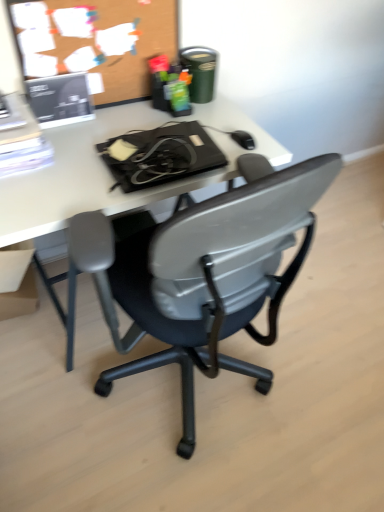
Question: From the image's perspective, is matte cardboard box at lower left on top of white plastic desk at center?

Choices:
 (A) yes
 (B) no

Answer: (B)

Question: Is matte cardboard box at lower left shorter than white plastic desk at center?

Choices:
 (A) no
 (B) yes

Answer: (B)

Question: Is matte cardboard box at lower left bigger than white plastic desk at center?

Choices:
 (A) no
 (B) yes

Answer: (A)

Question: Is matte cardboard box at lower left positioned behind white plastic desk at center?

Choices:
 (A) no
 (B) yes

Answer: (B)

Question: Could you tell me if matte cardboard box at lower left is turned towards white plastic desk at center?

Choices:
 (A) no
 (B) yes

Answer: (B)

Question: Which is correct: black plastic chair at center is inside white plastic desk at center, or outside of it?

Choices:
 (A) outside
 (B) inside

Answer: (A)

Question: In terms of height, does black plastic chair at center look taller or shorter compared to white plastic desk at center?

Choices:
 (A) short
 (B) tall

Answer: (A)

Question: In terms of width, does black plastic chair at center look wider or thinner when compared to white plastic desk at center?

Choices:
 (A) thin
 (B) wide

Answer: (B)

Question: From a real-world perspective, is black plastic chair at center above or below white plastic desk at center?

Choices:
 (A) above
 (B) below

Answer: (B)

Question: Considering the positions of matte cardboard box at lower left and white plastic desk at center in the image, is matte cardboard box at lower left wider or thinner than white plastic desk at center?

Choices:
 (A) thin
 (B) wide

Answer: (A)

Question: From a real-world perspective, is matte cardboard box at lower left above or below white plastic desk at center?

Choices:
 (A) above
 (B) below

Answer: (B)

Question: Is matte cardboard box at lower left inside the boundaries of white plastic desk at center, or outside?

Choices:
 (A) inside
 (B) outside

Answer: (A)

Question: Relative to white plastic desk at center, is matte cardboard box at lower left in front or behind?

Choices:
 (A) front
 (B) behind

Answer: (B)

Question: Considering their positions, is black plastic chair at center located in front of or behind matte cardboard box at lower left?

Choices:
 (A) behind
 (B) front

Answer: (B)

Question: In terms of height, does black plastic chair at center look taller or shorter compared to matte cardboard box at lower left?

Choices:
 (A) short
 (B) tall

Answer: (A)